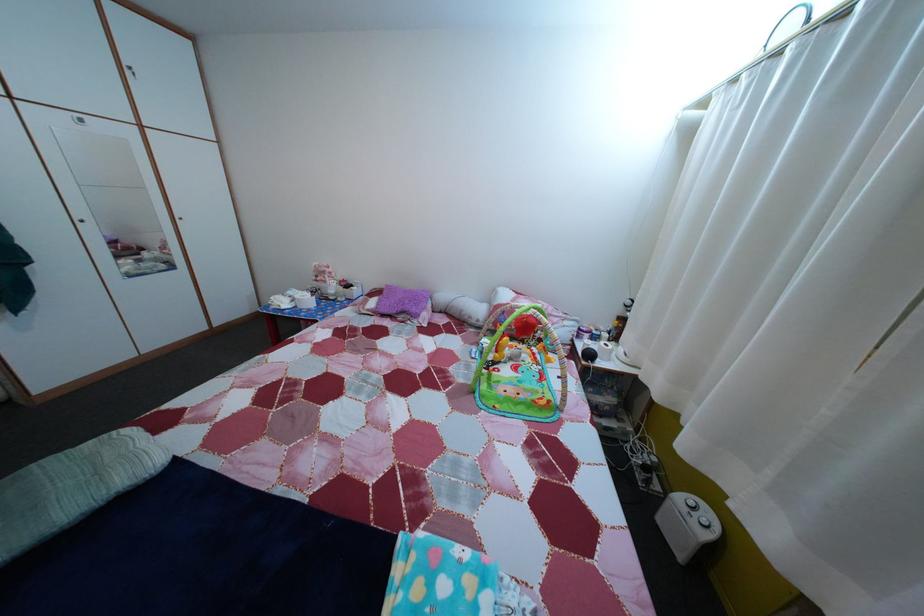
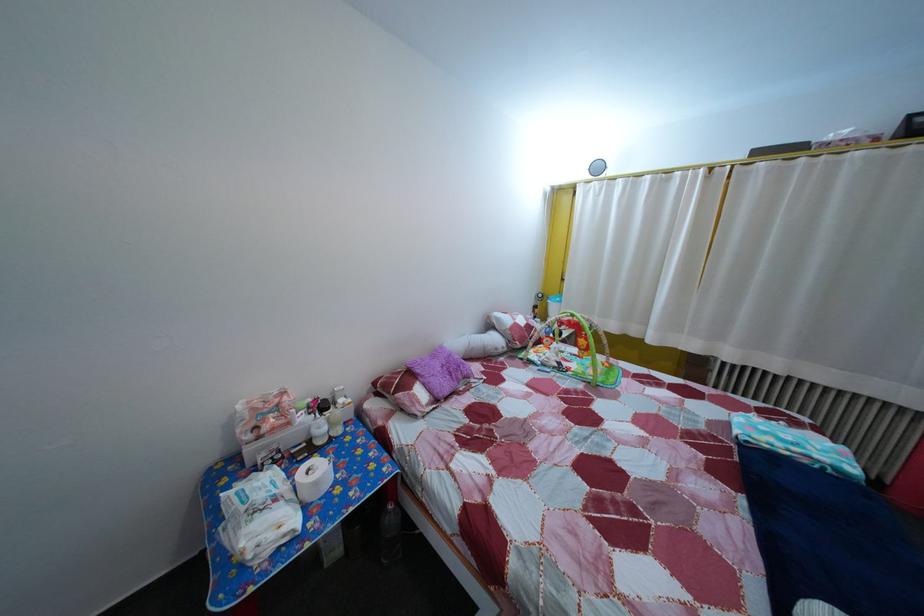
Where in the second image is the point corresponding to (x=334, y=290) from the first image?

(298, 432)